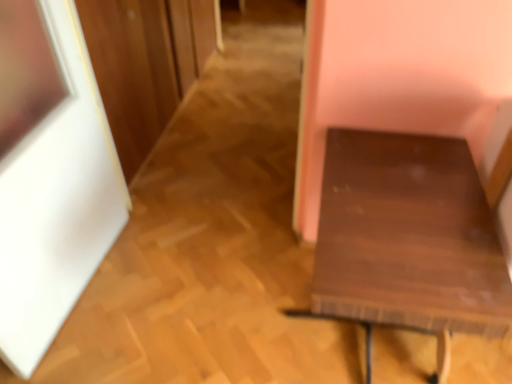
You are a GUI agent. You are given a task and a screenshot of the screen. Output one action in this format:
    pyautogui.click(x=<x>, y=<y>)
    Task: Click on the vacant region to the left of dark wood table at right
    
    Given the screenshot: What is the action you would take?
    pyautogui.click(x=208, y=303)